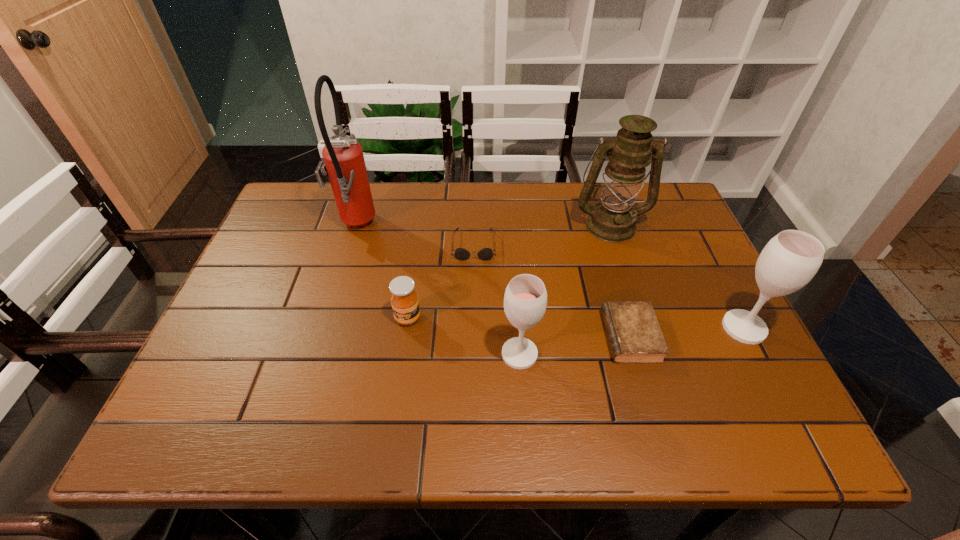
Where is `fire extinguisher located in the far edge section of the desktop`? fire extinguisher located in the far edge section of the desktop is located at coordinates (345, 166).

Locate an element on the screen. sunglasses that is positioned at the far edge is located at coordinates (462, 254).

You are a GUI agent. You are given a task and a screenshot of the screen. Output one action in this format:
    pyautogui.click(x=<x>, y=<y>)
    Task: Click on the oil lamp present at the far edge
    
    Given the screenshot: What is the action you would take?
    pyautogui.click(x=613, y=219)

You are a GUI agent. You are given a task and a screenshot of the screen. Output one action in this format:
    pyautogui.click(x=<x>, y=<y>)
    Task: Click on the wineglass situated at the near edge
    
    Given the screenshot: What is the action you would take?
    pyautogui.click(x=525, y=300)

Locate an element on the screen. The image size is (960, 540). diary at the near edge is located at coordinates [634, 335].

What are the coordinates of `wineglass situated at the right edge` in the screenshot? It's located at (788, 262).

What are the coordinates of `oil lamp at the right edge` in the screenshot? It's located at (613, 219).

I want to click on object at the far right corner, so (x=613, y=219).

Image resolution: width=960 pixels, height=540 pixels. In the image, there is a desktop. What are the coordinates of `free space at the far edge` in the screenshot? It's located at (539, 227).

Where is `vacant space at the near edge`? This screenshot has width=960, height=540. vacant space at the near edge is located at coordinates (485, 374).